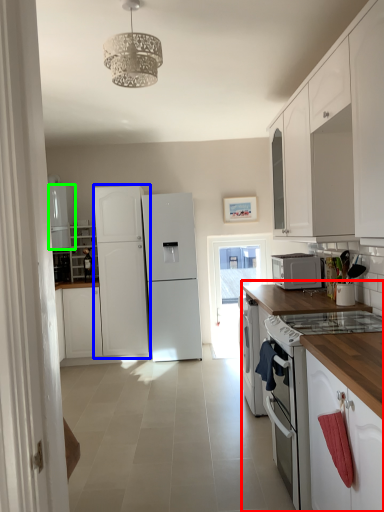
Question: Which object is the farthest from countertop (highlighted by a red box)? Choose among these: refrigerator (highlighted by a blue box) or refrigerator (highlighted by a green box).

Choices:
 (A) refrigerator
 (B) refrigerator

Answer: (B)